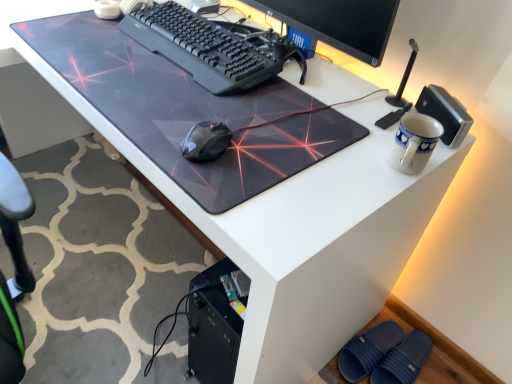
Question: Based on their sizes in the image, would you say transparent plastic mousepad at center is bigger or smaller than blue textured slipper at lower right?

Choices:
 (A) small
 (B) big

Answer: (B)

Question: From the image's perspective, is transparent plastic mousepad at center positioned above or below blue textured slipper at lower right?

Choices:
 (A) above
 (B) below

Answer: (A)

Question: Estimate the real-world distances between objects in this image. Which object is closer to the blue rubber slippers at lower right?

Choices:
 (A) black plastic keyboard at center
 (B) blue textured slipper at lower right
 (C) blue ceramic mug at upper right
 (D) transparent plastic mousepad at center

Answer: (B)

Question: Which is nearer to the blue rubber slippers at lower right?

Choices:
 (A) black plastic keyboard at center
 (B) blue textured slipper at lower right
 (C) blue ceramic mug at upper right
 (D) transparent plastic mousepad at center

Answer: (B)